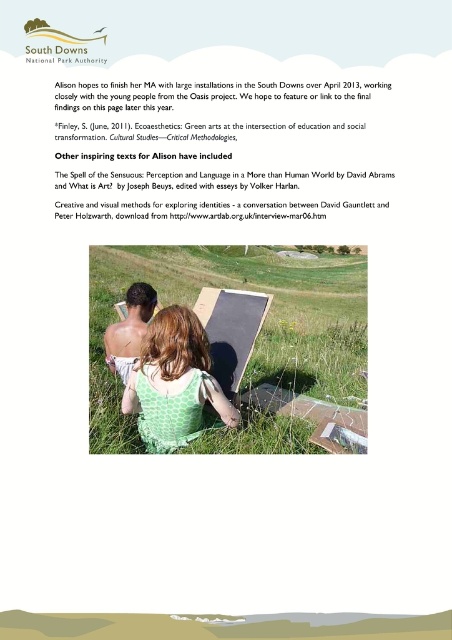
Which is more to the left, green grass at center or green dotted dress at center?

green dotted dress at center is more to the left.

Does green grass at center have a lesser width compared to green dotted dress at center?

In fact, green grass at center might be wider than green dotted dress at center.

Is point (278, 444) closer to viewer compared to point (158, 442)?

No.

At what (x,y) coordinates should I click in order to perform the action: click on green grass at center. Please return your answer as a coordinate pair (x, y). The image size is (452, 640). Looking at the image, I should click on (258, 333).

Which of these two, green dotted dress at center or shiny metallic book at center, stands taller?

green dotted dress at center

Who is higher up, green dotted dress at center or shiny metallic book at center?

shiny metallic book at center is above.

Between point (147, 328) and point (155, 300), which one is positioned behind?

Positioned behind is point (155, 300).

In order to click on green dotted dress at center in this screenshot , I will do `click(174, 381)`.

Is the position of green grass at center less distant than that of shiny metallic book at center?

Yes, green grass at center is in front of shiny metallic book at center.

Does green grass at center appear under shiny metallic book at center?

Actually, green grass at center is above shiny metallic book at center.

Locate an element on the screen. The height and width of the screenshot is (640, 452). green grass at center is located at coordinates (258, 333).

The height and width of the screenshot is (640, 452). Identify the location of green grass at center. (258, 333).